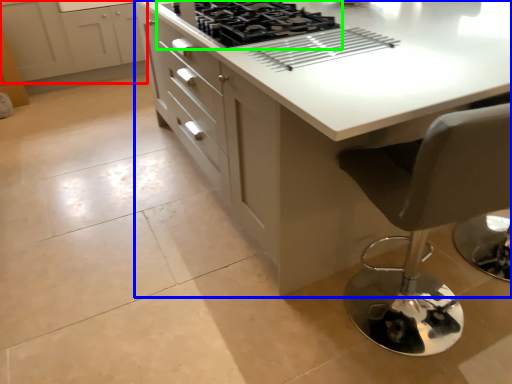
Question: Which is farther away from cabinetry (highlighted by a red box)? countertop (highlighted by a blue box) or gas stove (highlighted by a green box)?

Choices:
 (A) countertop
 (B) gas stove

Answer: (A)